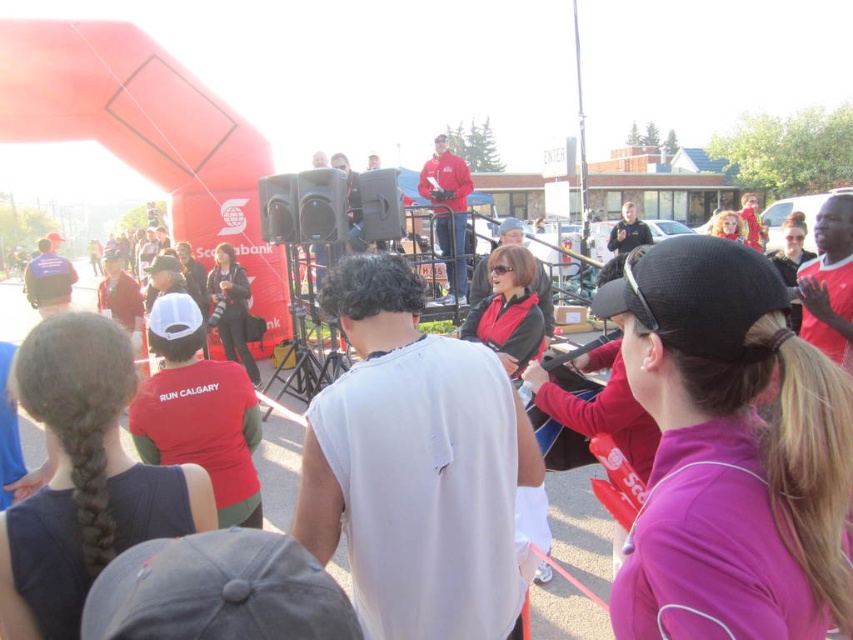
Question: Which point is farther to the camera?

Choices:
 (A) white matte shirt at center
 (B) matte red jacket at upper center

Answer: (B)

Question: Does white matte shirt at center have a smaller size compared to matte red jacket at upper center?

Choices:
 (A) yes
 (B) no

Answer: (A)

Question: Does white matte shirt at center appear under matte red jacket at upper center?

Choices:
 (A) yes
 (B) no

Answer: (A)

Question: Which point appears farthest from the camera in this image?

Choices:
 (A) (461, 163)
 (B) (378, 566)

Answer: (A)

Question: Is white matte shirt at center below matte red jacket at upper center?

Choices:
 (A) yes
 (B) no

Answer: (A)